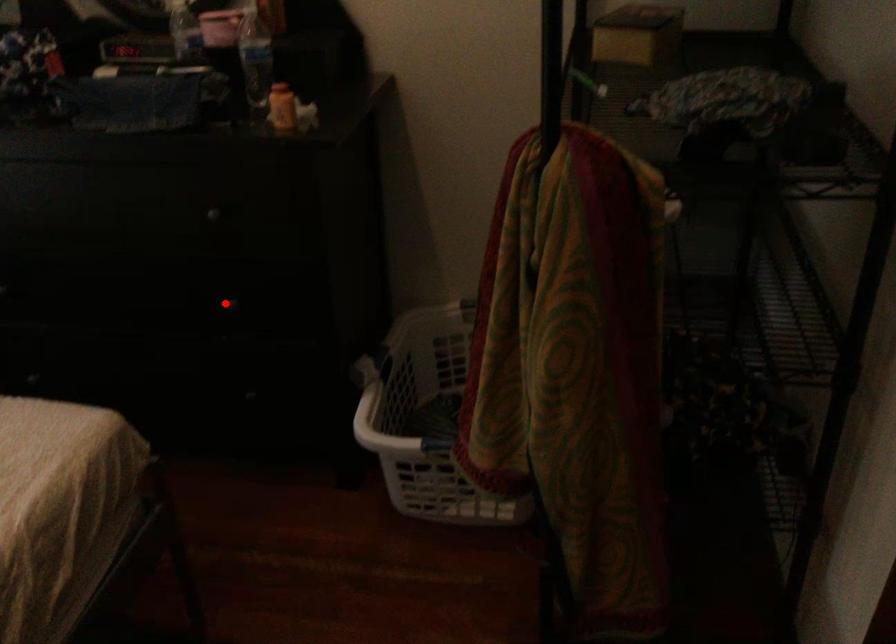
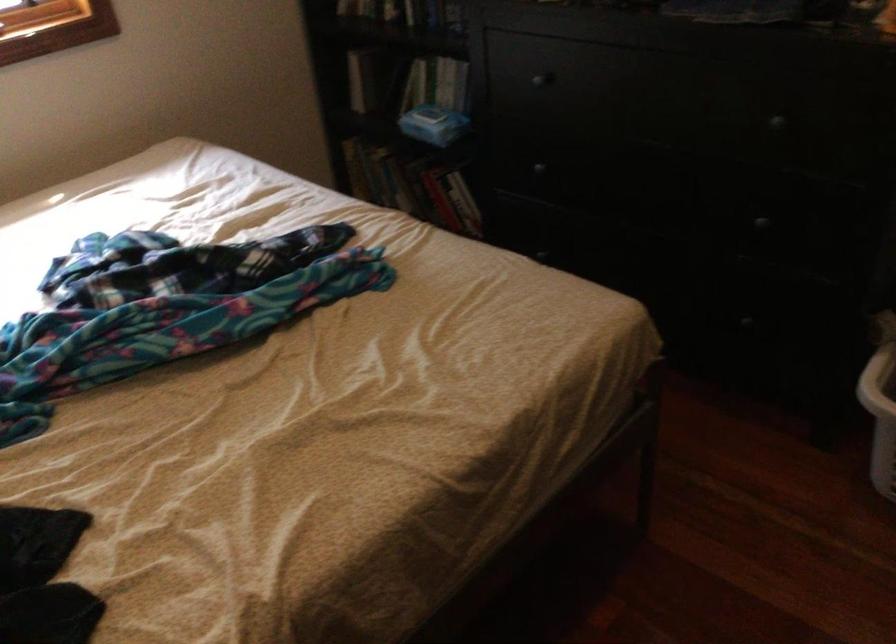
Locate, in the second image, the point that corresponds to the highlighted location in the first image.

(761, 223)